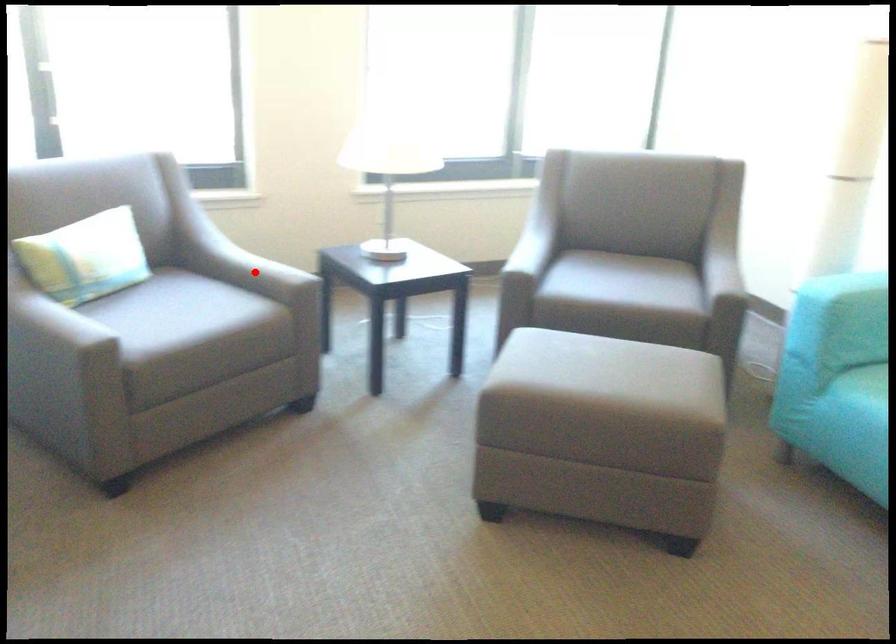
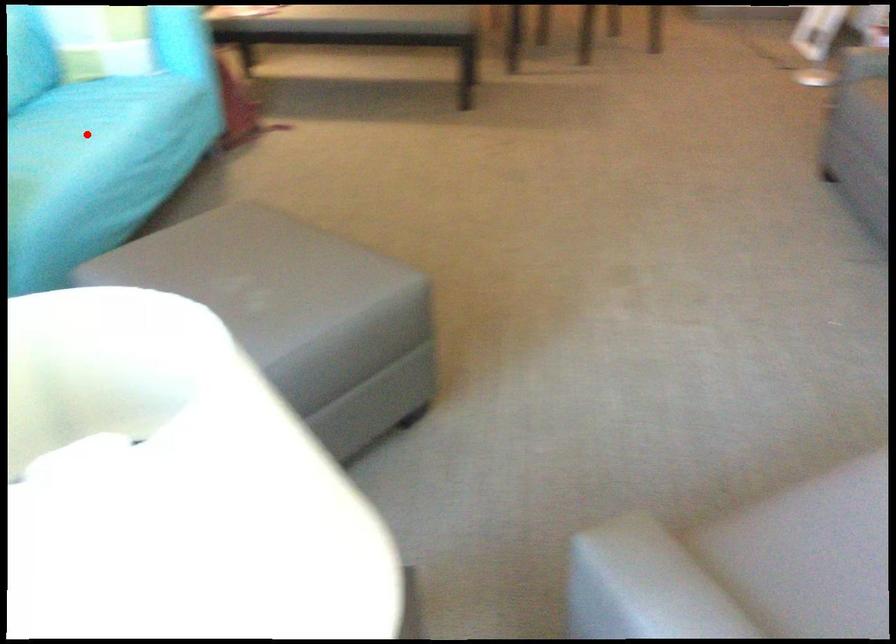
I am providing you with two images of the same scene from different viewpoints. A red point is marked on the first image and another point is marked on the second image. Does the point marked in image1 correspond to the same location as the one in image2?

No